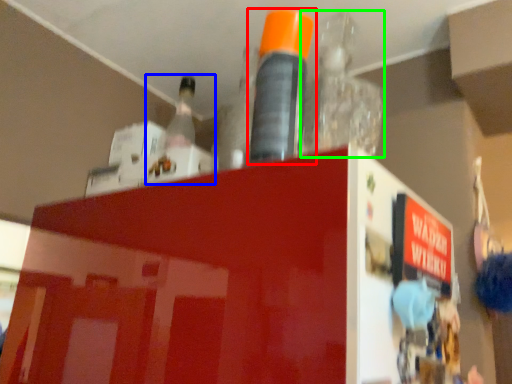
Question: Which is nearer to the bottle (highlighted by a red box)? bottle (highlighted by a blue box) or bottle (highlighted by a green box).

Choices:
 (A) bottle
 (B) bottle

Answer: (B)